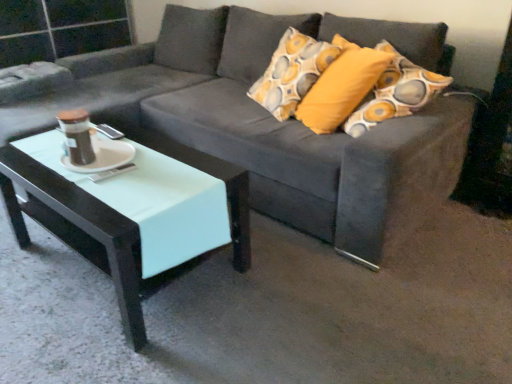
Identify the location of free spot to the right of white glossy saucer at center. The height and width of the screenshot is (384, 512). (154, 165).